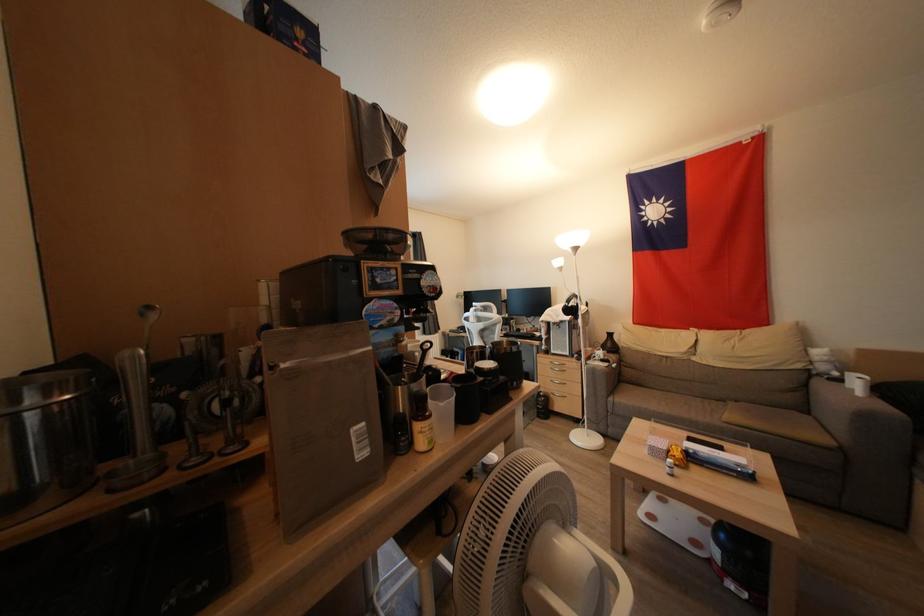
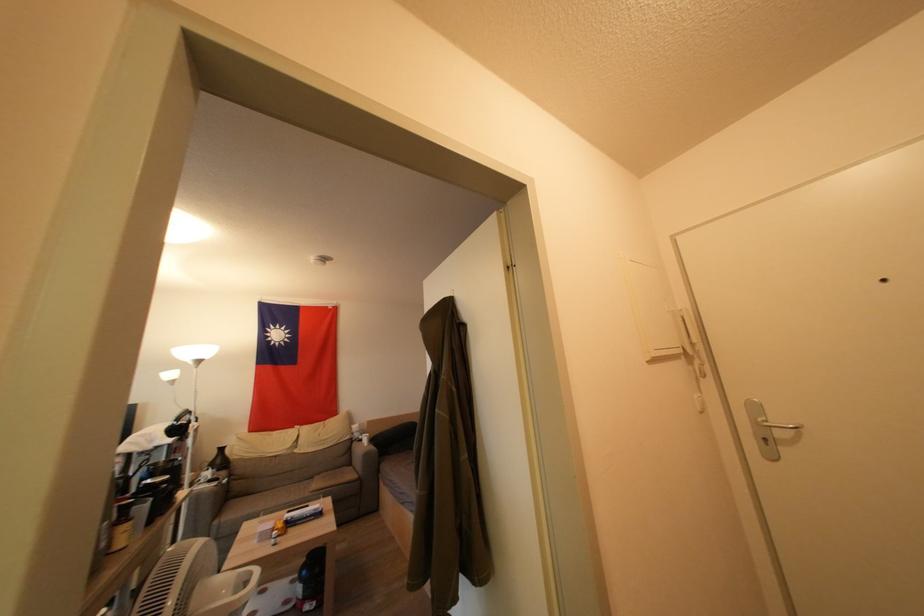
Find the pixel in the second image that matches point (621, 585) in the first image.

(256, 577)